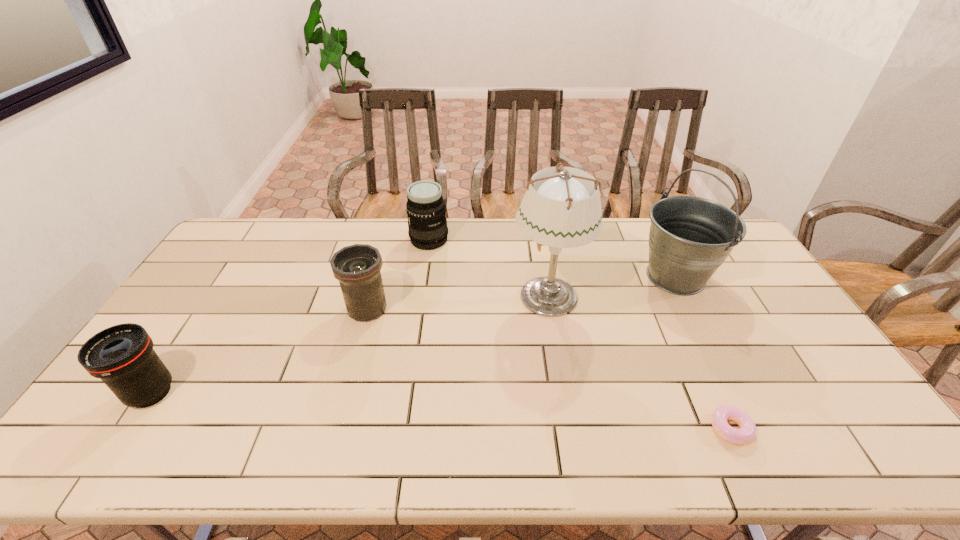
Locate an element on the screen. This screenshot has height=540, width=960. vacant space that is in between the farthest telephoto lens and the lampshade is located at coordinates (489, 268).

What are the coordinates of `empty location between the leftmost object and the fifth object from right to left` in the screenshot? It's located at (259, 351).

Locate an element on the screen. The image size is (960, 540). vacant region between the doughnut and the rightmost telephoto lens is located at coordinates (580, 334).

What are the coordinates of `free space between the leftmost telephoto lens and the doughnut` in the screenshot? It's located at (441, 410).

Where is `free space between the second telephoto lens from right to left and the lampshade`? free space between the second telephoto lens from right to left and the lampshade is located at coordinates (458, 302).

Locate an element on the screen. vacant area between the farthest telephoto lens and the lampshade is located at coordinates (489, 268).

Select which object appears as the closest to the fifth shortest object. Please provide its 2D coordinates. Your answer should be formatted as a tuple, i.e. [(x, y)], where the tuple contains the x and y coordinates of a point satisfying the conditions above.

[(562, 209)]

Where is `object that ranks as the fifth closest to the shortest object`? The height and width of the screenshot is (540, 960). object that ranks as the fifth closest to the shortest object is located at coordinates (x=122, y=356).

The image size is (960, 540). Find the location of `the closest telephoto lens to the fourth object from left to right`. the closest telephoto lens to the fourth object from left to right is located at coordinates (426, 211).

The height and width of the screenshot is (540, 960). Identify the location of telephoto lens that is the closest one to the shortest object. (357, 267).